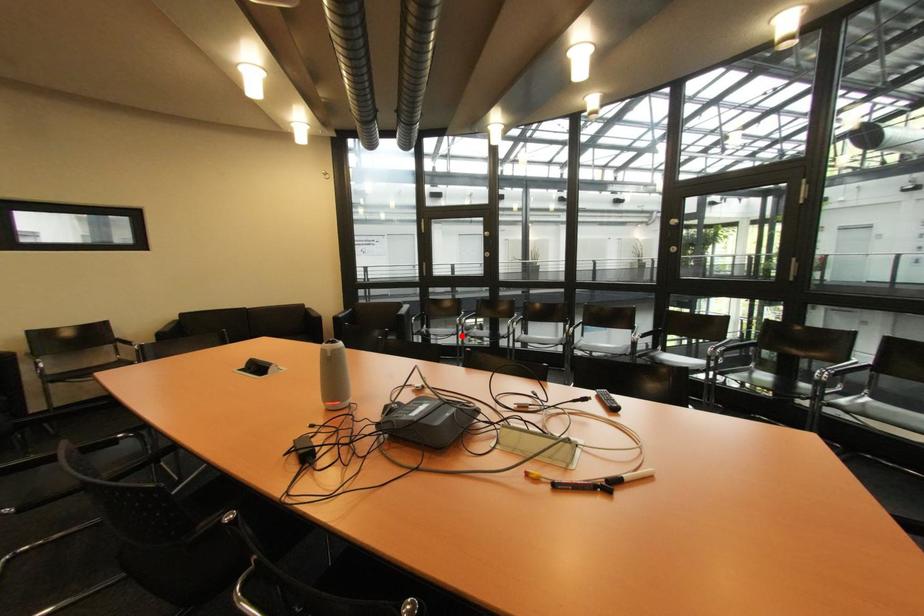
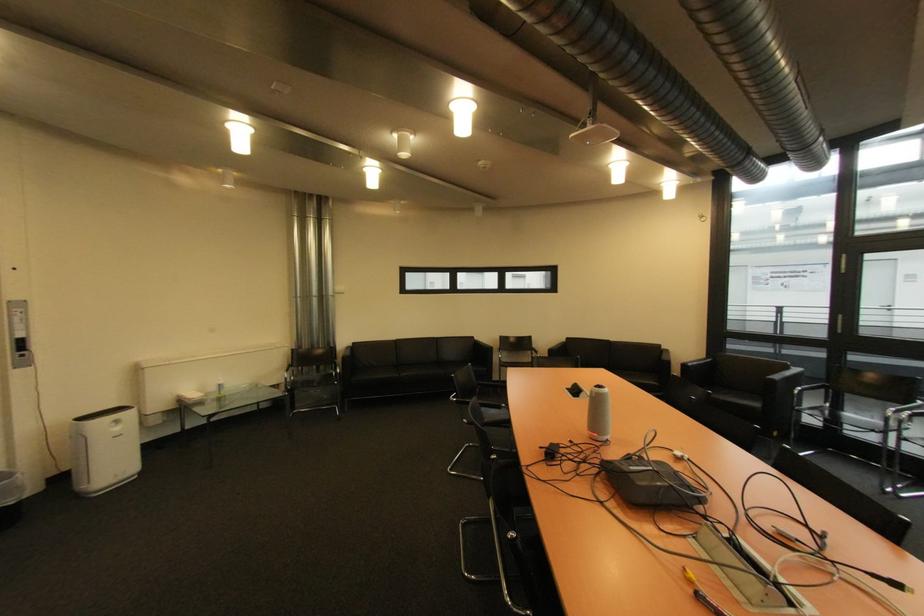
Question: I am providing you with two images of the same scene from different viewpoints. A red point is shown in image1. For the corresponding object point in image2, is it positioned nearer or farther from the camera?

Choices:
 (A) Nearer
 (B) Farther

Answer: (A)